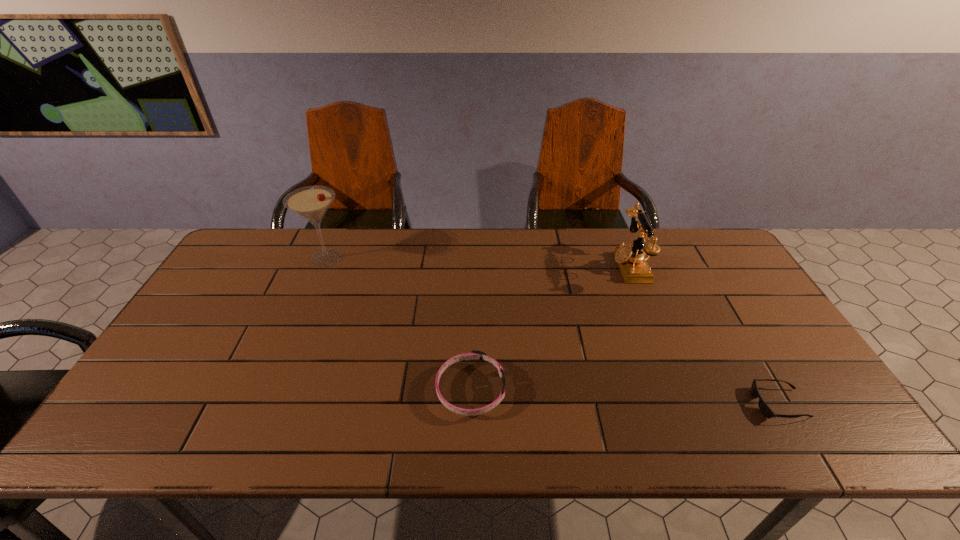
What are the coordinates of `the tallest object` in the screenshot? It's located at (310, 202).

This screenshot has width=960, height=540. Identify the location of the leftmost object. (310, 202).

This screenshot has width=960, height=540. I want to click on telephone, so click(634, 267).

In order to click on the second object from right to left in this screenshot , I will do `click(634, 267)`.

This screenshot has width=960, height=540. Find the location of `dog collar`. dog collar is located at coordinates (474, 355).

This screenshot has height=540, width=960. Identify the location of the third object from right to left. (474, 355).

Locate an element on the screen. the shortest object is located at coordinates (764, 408).

Find the location of a particular element. The height and width of the screenshot is (540, 960). the rightmost object is located at coordinates (764, 408).

Identify the location of vacant space located on the front of the martini. This screenshot has height=540, width=960. (280, 368).

Where is `free spot located 0.280m on the dial of the telephone`? free spot located 0.280m on the dial of the telephone is located at coordinates (527, 266).